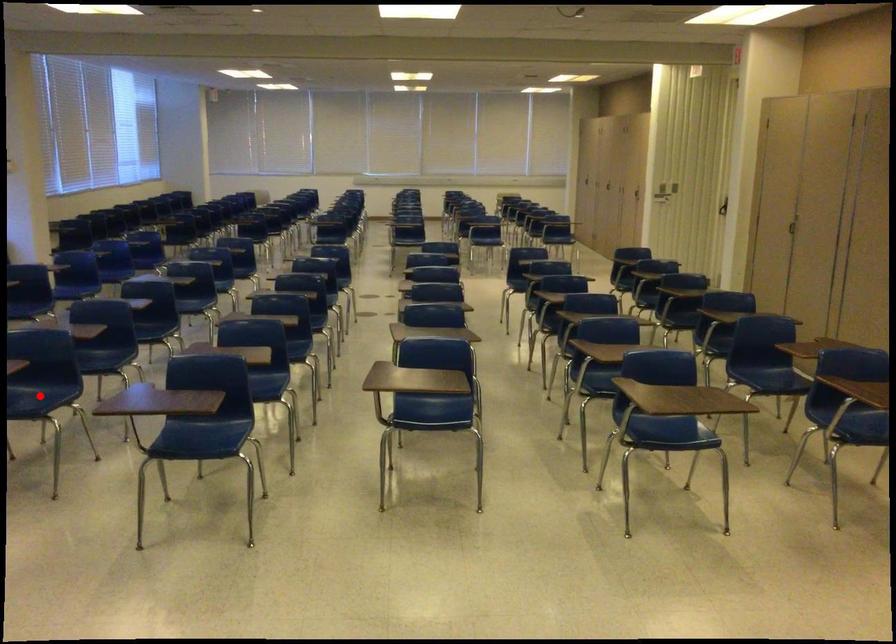
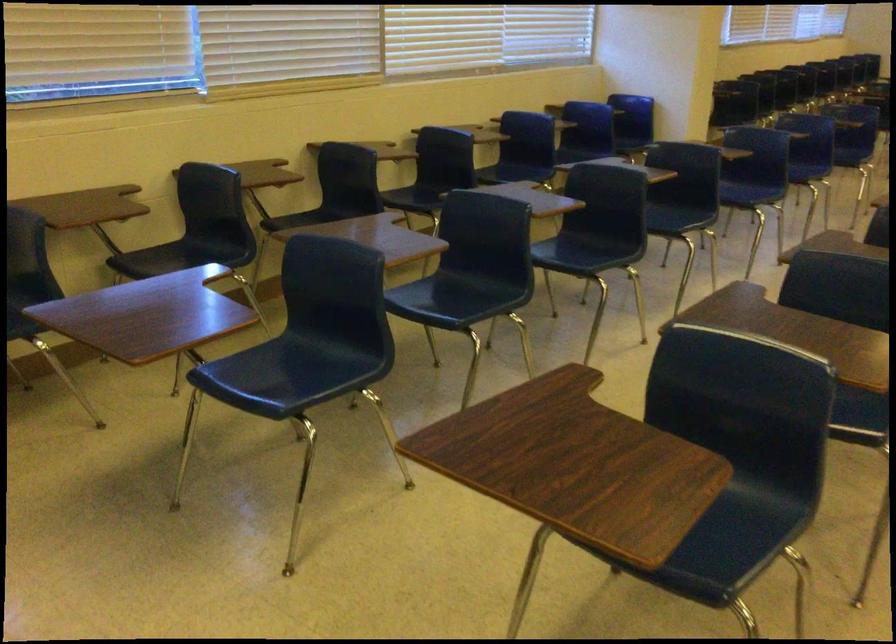
Question: I am providing you with two images of the same scene from different viewpoints. A red point is marked on the first image. At the location where the point appears in image 1, is it still visible in image 2?

Choices:
 (A) Yes
 (B) No

Answer: (B)